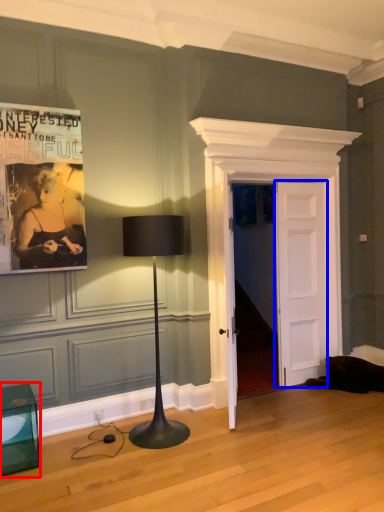
Question: Which of the following is the farthest to the observer, furniture (highlighted by a red box) or door (highlighted by a blue box)?

Choices:
 (A) furniture
 (B) door

Answer: (B)